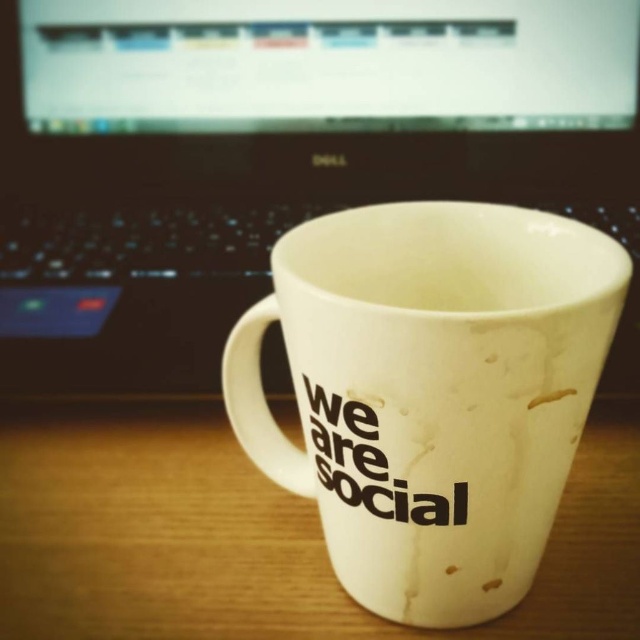
Does black plastic laptop at center have a greater height compared to white matte mug at center?

Correct, black plastic laptop at center is much taller as white matte mug at center.

Can you confirm if black plastic laptop at center is positioned above white matte mug at center?

Correct, black plastic laptop at center is located above white matte mug at center.

Locate an element on the screen. This screenshot has height=640, width=640. black plastic laptop at center is located at coordinates click(276, 156).

Is black plastic laptop at center to the right of white matte wood table at center from the viewer's perspective?

In fact, black plastic laptop at center is to the left of white matte wood table at center.

You are a GUI agent. You are given a task and a screenshot of the screen. Output one action in this format:
    pyautogui.click(x=<x>, y=<y>)
    Task: Click on the black plastic laptop at center
    Image resolution: width=640 pixels, height=640 pixels.
    Given the screenshot: What is the action you would take?
    pyautogui.click(x=276, y=156)

Which is behind, point (106, 211) or point (173, 602)?

Point (106, 211)

Identify the location of black plastic laptop at center. (276, 156).

Is point (529, 422) farther from viewer compared to point (241, 572)?

No.

Can you confirm if white matte mug at center is positioned below white matte wood table at center?

Incorrect, white matte mug at center is not positioned below white matte wood table at center.

Is point (358, 468) in front of point (216, 515)?

Yes, point (358, 468) is closer to viewer.

Identify the location of white matte mug at center. The image size is (640, 640). (432, 392).